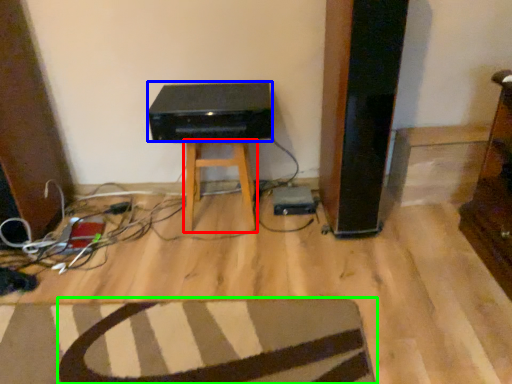
Question: Based on their relative distances, which object is nearer to stool (highlighted by a red box)? Choose from stereo (highlighted by a blue box) and furniture (highlighted by a green box).

Choices:
 (A) stereo
 (B) furniture

Answer: (A)